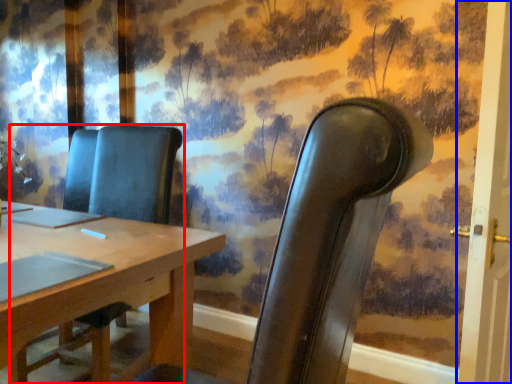
Question: Which object appears closest to the camera in this image, chair (highlighted by a red box) or door (highlighted by a blue box)?

Choices:
 (A) chair
 (B) door

Answer: (A)